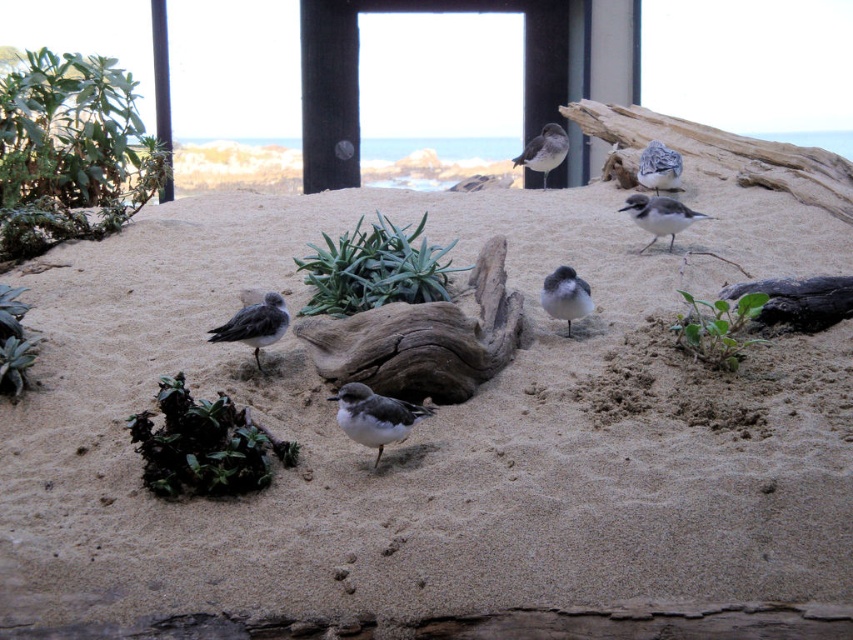
Which is below, green succulent at lower left or gray matte bird at upper right?

green succulent at lower left

Is green succulent at lower left above gray matte bird at upper right?

No.

Locate an element on the screen. The width and height of the screenshot is (853, 640). green succulent at lower left is located at coordinates 13,342.

Identify the location of green succulent at lower left. The height and width of the screenshot is (640, 853). (13, 342).

Is gray speckled bird at upper center below gray matte bird at upper right?

Actually, gray speckled bird at upper center is above gray matte bird at upper right.

Does gray speckled bird at upper center lie behind gray matte bird at upper right?

Yes, gray speckled bird at upper center is behind gray matte bird at upper right.

Identify the location of gray speckled bird at upper center. This screenshot has height=640, width=853. (544, 150).

Is point (247, 316) closer to viewer compared to point (544, 141)?

Yes.

Which is in front, point (210, 339) or point (544, 129)?

Point (210, 339) is in front.

Does point (228, 321) come farther from viewer compared to point (543, 164)?

That is False.

Where is `gray matte bird at lower left`? This screenshot has width=853, height=640. gray matte bird at lower left is located at coordinates (254, 324).